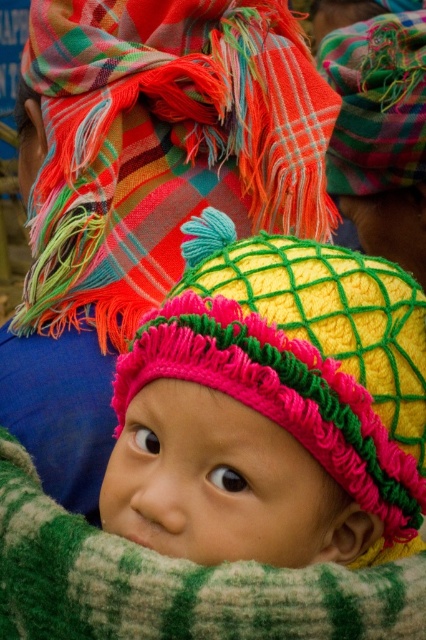
Question: Does multicolored woven scarf at upper center have a greater width compared to green knitted blanket at center?

Choices:
 (A) no
 (B) yes

Answer: (B)

Question: Which point is closer to the camera taking this photo?

Choices:
 (A) (5, 570)
 (B) (187, 422)
 (C) (207, 156)

Answer: (B)

Question: Is knitted yellow hat at center thinner than multicolored woven scarf at upper center?

Choices:
 (A) yes
 (B) no

Answer: (A)

Question: Where is knitted yellow hat at center located in relation to green knitted blanket at center in the image?

Choices:
 (A) above
 (B) below

Answer: (A)

Question: Which point is farther from the camera taking this photo?

Choices:
 (A) (290, 563)
 (B) (126, 180)
 (C) (363, 602)

Answer: (B)

Question: Which point appears closest to the camera in this image?

Choices:
 (A) (284, 520)
 (B) (19, 612)

Answer: (A)